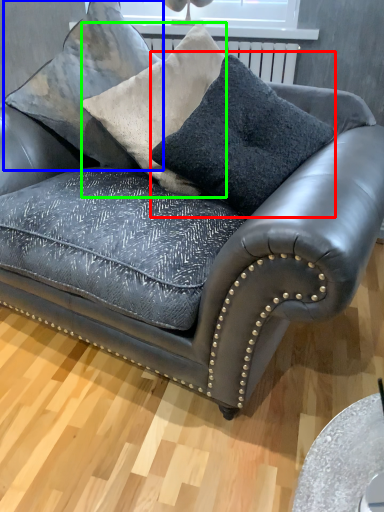
Question: Considering the real-world distances, which object is farthest from throw pillow (highlighted by a red box)? pillow (highlighted by a blue box) or throw pillow (highlighted by a green box)?

Choices:
 (A) pillow
 (B) throw pillow

Answer: (A)